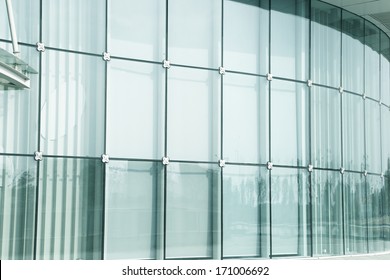
You are a GUI agent. You are given a task and a screenshot of the screen. Output one action in this format:
    pyautogui.click(x=<x>, y=<y>)
    Task: Click on the wall
    
    Given the screenshot: What is the action you would take?
    pyautogui.click(x=255, y=88)